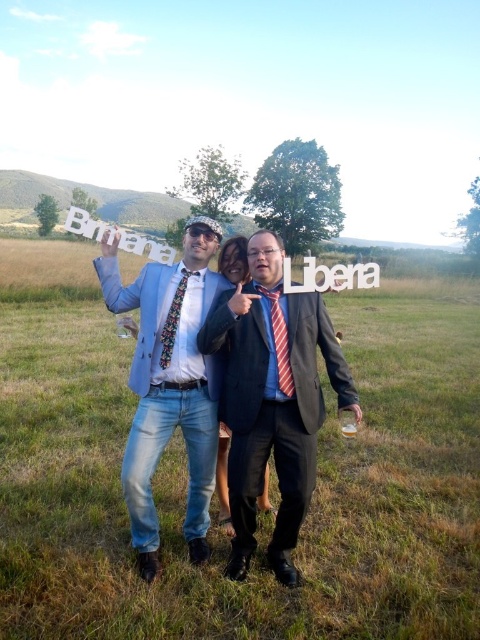
In the scene shown: You are a photographer setting up for a group photo. You notice the matte black suit at center and the light blue denim jeans at center. Which one is positioned lower in the frame?

The matte black suit at center is positioned lower in the frame than the light blue denim jeans at center.

You are a photographer trying to capture a photo of the matte black suit at center and the light blue denim jeans at center. Based on their sizes, which object would you need to focus on first if you want to ensure both are in frame without moving the camera?

The matte black suit at center is much taller as light blue denim jeans at center, so you should focus on the matte black suit at center first to ensure both are in frame without moving the camera.

You are a photographer trying to capture a photo of the three people in the grassy field. You want to ensure both points, point (301, 362) and point (245, 275), are visible in the frame. Which point should be placed closer to the edge of the frame to avoid cropping?

Point (245, 275) should be placed closer to the edge of the frame because it is farther from the viewer compared to point (301, 362), ensuring both points remain visible without cropping.